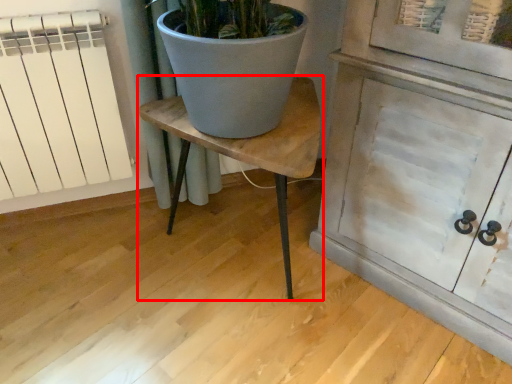
Question: From the image's perspective, considering the relative positions of table (annotated by the red box) and radiator in the image provided, where is table (annotated by the red box) located with respect to the staircase?

Choices:
 (A) above
 (B) below

Answer: (B)